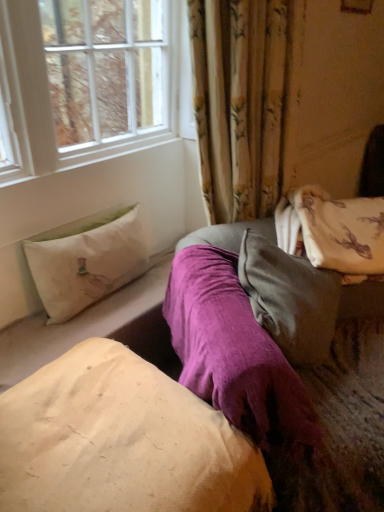
Question: Should I look upward or downward to see velvety gray pillow at center, arranged as the 2th pillow when viewed from the top?

Choices:
 (A) up
 (B) down

Answer: (B)

Question: In which direction should I rotate to look at beige cotton pillow at center, placed as the 1th pillow when sorted from bottom to top?

Choices:
 (A) right
 (B) left

Answer: (B)

Question: Is beige cotton pillow at center, which is the 3th pillow in top-to-bottom order, bigger than velvety gray pillow at center, arranged as the 2th pillow when viewed from the top?

Choices:
 (A) yes
 (B) no

Answer: (A)

Question: Is beige cotton pillow at center, placed as the 1th pillow when sorted from bottom to top, smaller than velvety gray pillow at center, marked as the 2th pillow in a bottom-to-top arrangement?

Choices:
 (A) no
 (B) yes

Answer: (A)

Question: Can you confirm if beige cotton pillow at center, placed as the 1th pillow when sorted from bottom to top, is shorter than velvety gray pillow at center, arranged as the 2th pillow when viewed from the top?

Choices:
 (A) yes
 (B) no

Answer: (B)

Question: Does beige cotton pillow at center, placed as the 1th pillow when sorted from bottom to top, have a greater height compared to velvety gray pillow at center, marked as the 2th pillow in a bottom-to-top arrangement?

Choices:
 (A) yes
 (B) no

Answer: (A)

Question: Is beige cotton pillow at center, placed as the 1th pillow when sorted from bottom to top, to the left of velvety gray pillow at center, arranged as the 2th pillow when viewed from the top, from the viewer's perspective?

Choices:
 (A) no
 (B) yes

Answer: (B)

Question: From a real-world perspective, is beige cotton pillow at center, placed as the 1th pillow when sorted from bottom to top, located beneath velvety gray pillow at center, arranged as the 2th pillow when viewed from the top?

Choices:
 (A) yes
 (B) no

Answer: (A)

Question: Can you confirm if white fabric pillow at left, which appears as the 1th pillow when viewed from the top, is taller than velvety gray pillow at center, arranged as the 2th pillow when viewed from the top?

Choices:
 (A) yes
 (B) no

Answer: (B)

Question: Is white fabric pillow at left, which appears as the 1th pillow when viewed from the top, looking in the opposite direction of velvety gray pillow at center, marked as the 2th pillow in a bottom-to-top arrangement?

Choices:
 (A) no
 (B) yes

Answer: (A)

Question: Is white fabric pillow at left, which appears as the 1th pillow when viewed from the top, at the right side of velvety gray pillow at center, arranged as the 2th pillow when viewed from the top?

Choices:
 (A) yes
 (B) no

Answer: (B)

Question: Is white fabric pillow at left, which appears as the 1th pillow when viewed from the top, thinner than velvety gray pillow at center, arranged as the 2th pillow when viewed from the top?

Choices:
 (A) no
 (B) yes

Answer: (B)

Question: From a real-world perspective, is white fabric pillow at left, which appears as the 1th pillow when viewed from the top, physically below velvety gray pillow at center, arranged as the 2th pillow when viewed from the top?

Choices:
 (A) no
 (B) yes

Answer: (B)

Question: From the image's perspective, is white fabric pillow at left, which appears as the 1th pillow when viewed from the top, on velvety gray pillow at center, marked as the 2th pillow in a bottom-to-top arrangement?

Choices:
 (A) no
 (B) yes

Answer: (B)

Question: Is there a large distance between beige cotton pillow at center, placed as the 1th pillow when sorted from bottom to top, and white fabric pillow at left, which appears as the 1th pillow when viewed from the top?

Choices:
 (A) no
 (B) yes

Answer: (A)